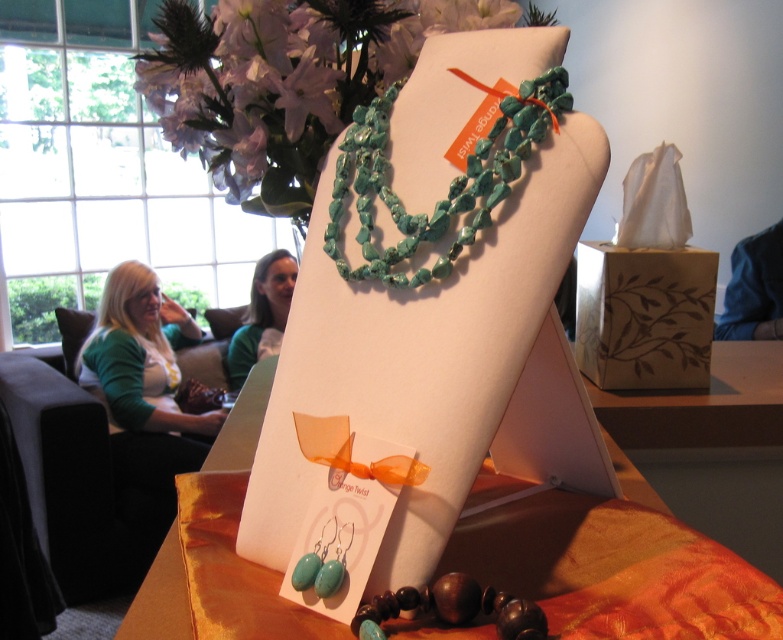
Looking at this image, you are a customer at the jewelry store and want to place a gift card on the orange silk table at center. However, there are silky purple petals at upper center in the way. Can you move the petals to the right side of the table to make space?

The silky purple petals at upper center is positioned on the left side of orange silk table at center. To move them to the right side of the table would require shifting them from their current left position, which is possible to create space for the gift card.

You are a store employee arranging items on a table. You have a green jersey at left and a green fabric at left. Which one is taller?

The green jersey at left is much taller than the green fabric at left.

You are a customer at the jewelry store and see both the green jersey at left and the green fabric at left displayed on the table. Which one takes up more space on the table?

The green jersey at left takes up more space on the table because it has a larger size compared to the green fabric at left.